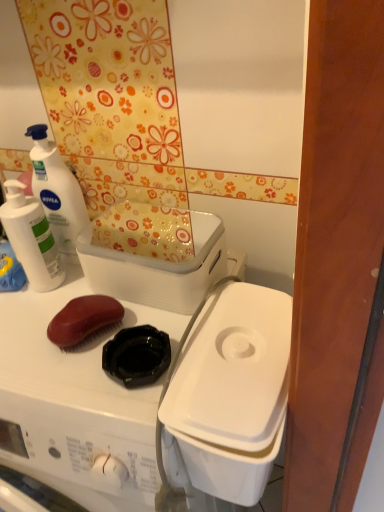
Find the location of a particular element. The width and height of the screenshot is (384, 512). unoccupied area in front of white matte lotion at upper left, the second cleaning product viewed from the left is located at coordinates (44, 326).